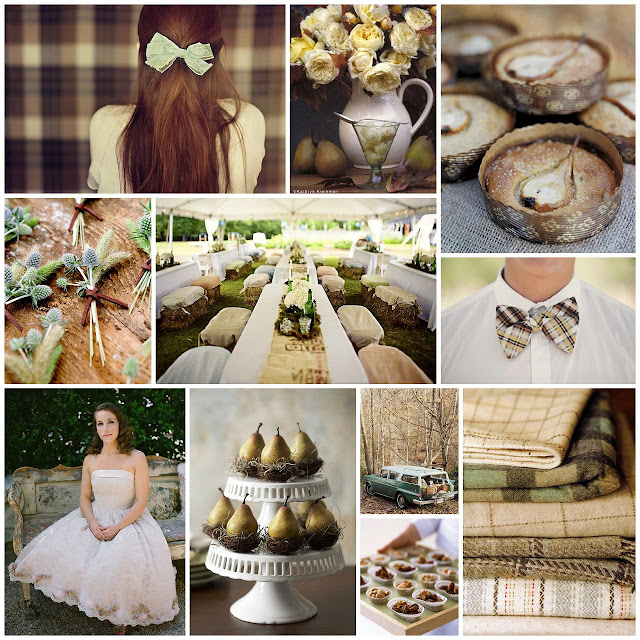
The height and width of the screenshot is (640, 640). Identify the location of stools. (393, 390), (387, 364), (361, 320), (217, 355), (233, 307).